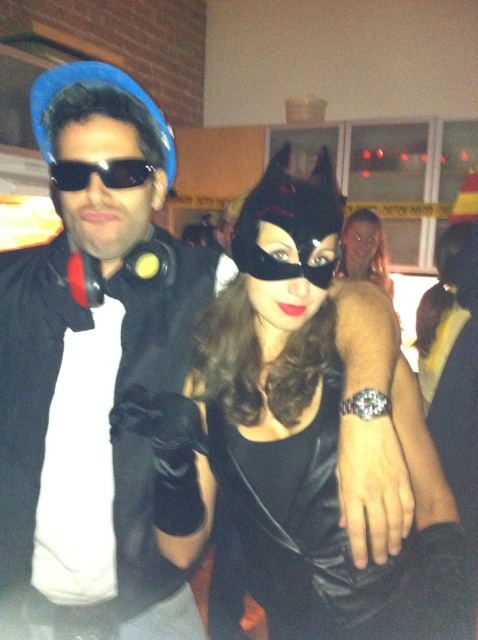
Question: Estimate the real-world distances between objects in this image. Which object is closer to the black matte sunglasses at center?

Choices:
 (A) matte black mask at center
 (B) matte black jacket at left

Answer: (B)

Question: Which object is the closest to the black leather mask at center?

Choices:
 (A) matte black jacket at left
 (B) black matte sunglasses at center
 (C) matte black mask at center

Answer: (A)

Question: Estimate the real-world distances between objects in this image. Which object is closer to the matte black mask at center?

Choices:
 (A) black leather mask at center
 (B) matte black jacket at left
 (C) black matte sunglasses at center

Answer: (B)

Question: Is matte black jacket at left above black matte sunglasses at center?

Choices:
 (A) yes
 (B) no

Answer: (B)

Question: Can you confirm if black leather mask at center is positioned to the left of black matte sunglasses at center?

Choices:
 (A) yes
 (B) no

Answer: (B)

Question: In this image, where is matte black mask at center located relative to black matte sunglasses at center?

Choices:
 (A) above
 (B) below

Answer: (A)